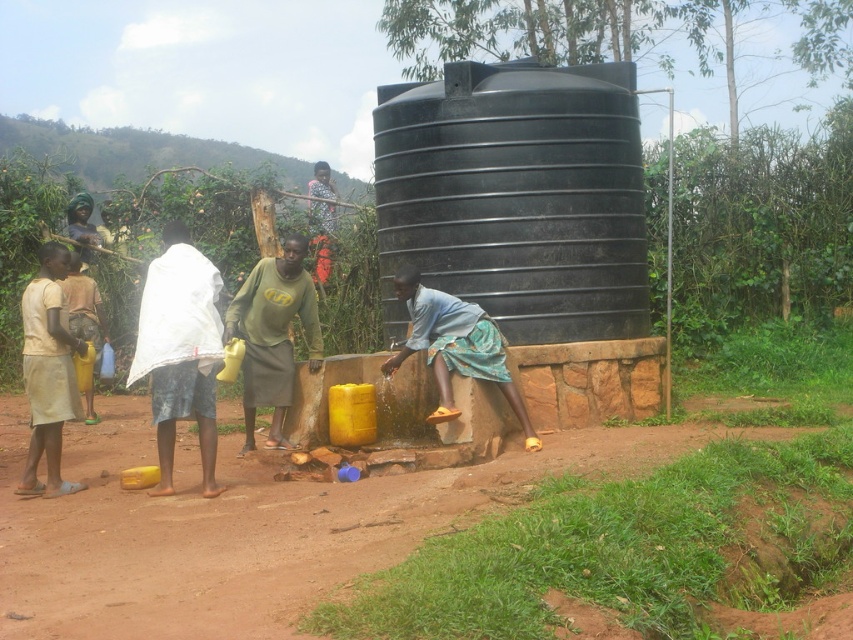
Between white cloth at left and light beige fabric shirt at left, which one appears on the left side from the viewer's perspective?

light beige fabric shirt at left

Is point (167, 230) farther from viewer compared to point (36, 420)?

That is True.

This screenshot has height=640, width=853. In order to click on white cloth at left in this screenshot , I will do `click(180, 349)`.

Who is taller, white cloth at left or green matte shirt at center?

With more height is white cloth at left.

Where is `white cloth at left`? Image resolution: width=853 pixels, height=640 pixels. white cloth at left is located at coordinates (180, 349).

I want to click on white cloth at left, so click(180, 349).

Who is shorter, white cloth at left or matte yellow jug at left?

matte yellow jug at left is shorter.

Is point (126, 387) in front of point (96, 417)?

No, (126, 387) is behind (96, 417).

Consider the image. Measure the distance between point [166,458] and camera.

Point [166,458] is 6.88 meters away from camera.

At what (x,y) coordinates should I click in order to perform the action: click on white cloth at left. Please return your answer as a coordinate pair (x, y). This screenshot has height=640, width=853. Looking at the image, I should click on (180, 349).